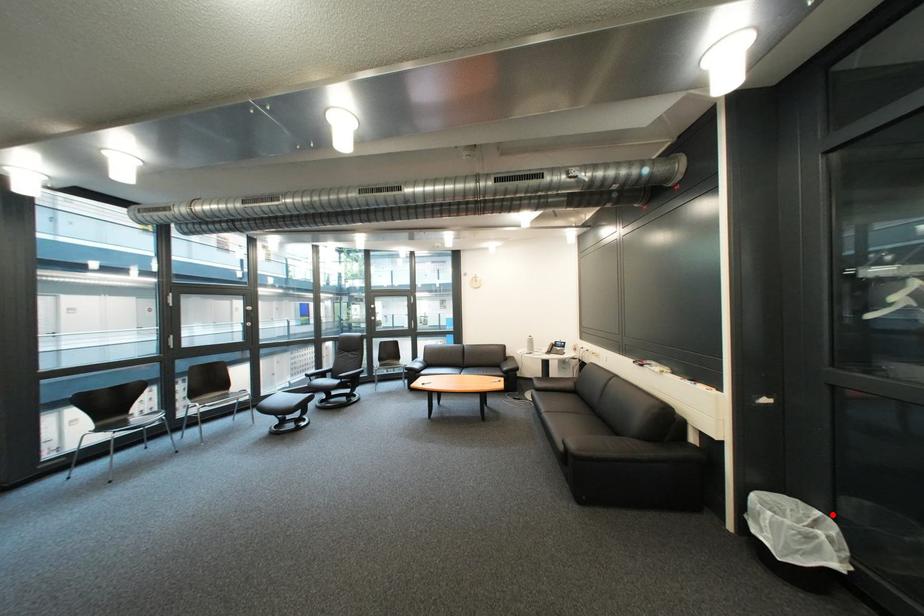
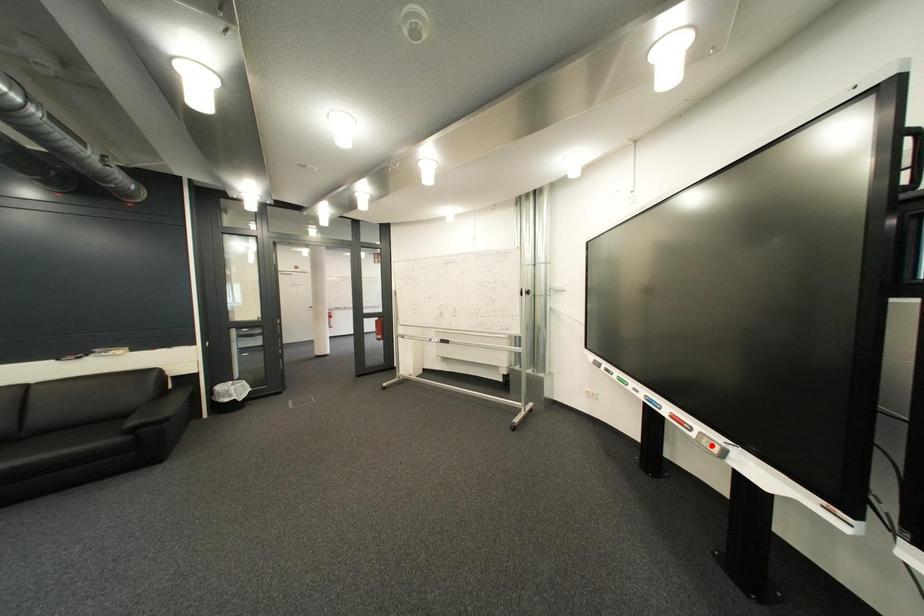
I am providing you with two images of the same scene from different viewpoints. A red point is marked on the first image and another point is marked on the second image. Are the points marked in image1 and image2 representing the same 3D position?

No